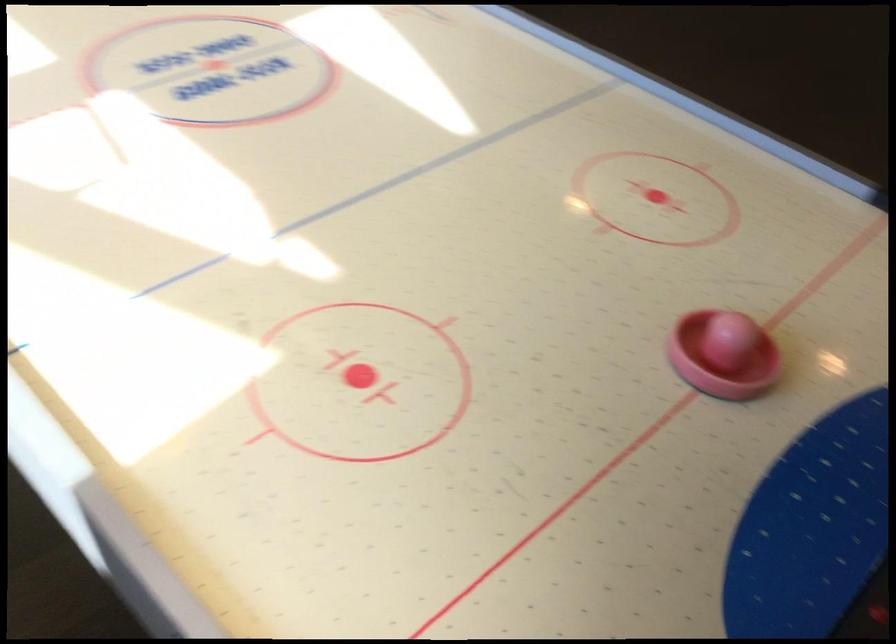
The width and height of the screenshot is (896, 644). What are the coordinates of `pink air hockey mallet` in the screenshot? It's located at (722, 355).